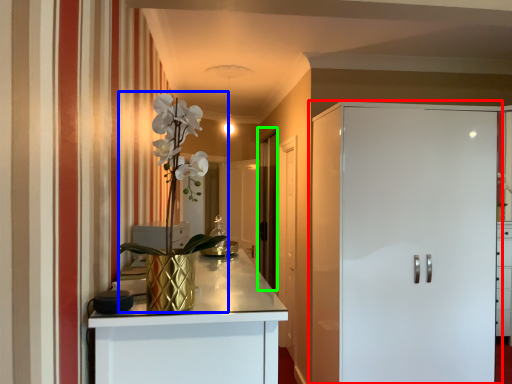
Question: Considering the real-world distances, which object is farthest from door (highlighted by a red box)? floral arrangement (highlighted by a blue box) or glass door (highlighted by a green box)?

Choices:
 (A) floral arrangement
 (B) glass door

Answer: (B)